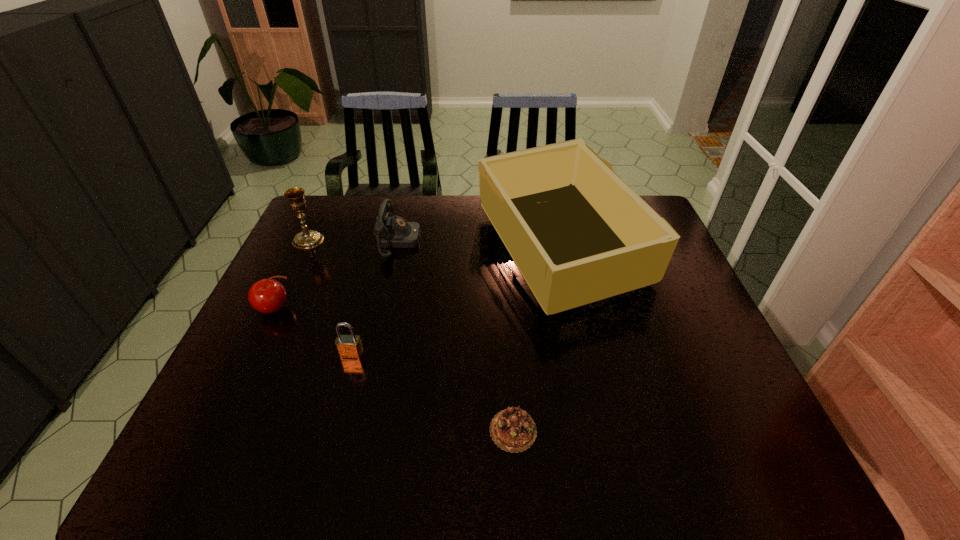
Find the location of a particular element. blank area in the image that satisfies the following two spatial constraints: 1. on the dial of the telephone; 2. on the right side of the shortest object is located at coordinates (357, 430).

Locate an element on the screen. The image size is (960, 540). vacant region that satisfies the following two spatial constraints: 1. on the dial of the tallest object; 2. on the left side of the telephone is located at coordinates (397, 248).

This screenshot has height=540, width=960. Identify the location of free spot that satisfies the following two spatial constraints: 1. on the dial of the telephone; 2. on the left side of the nearest object. (357, 430).